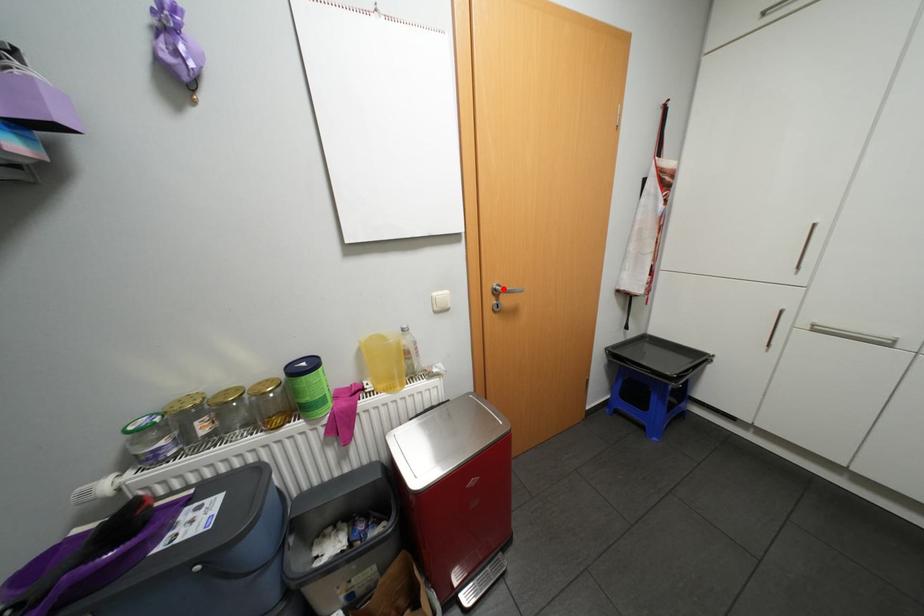
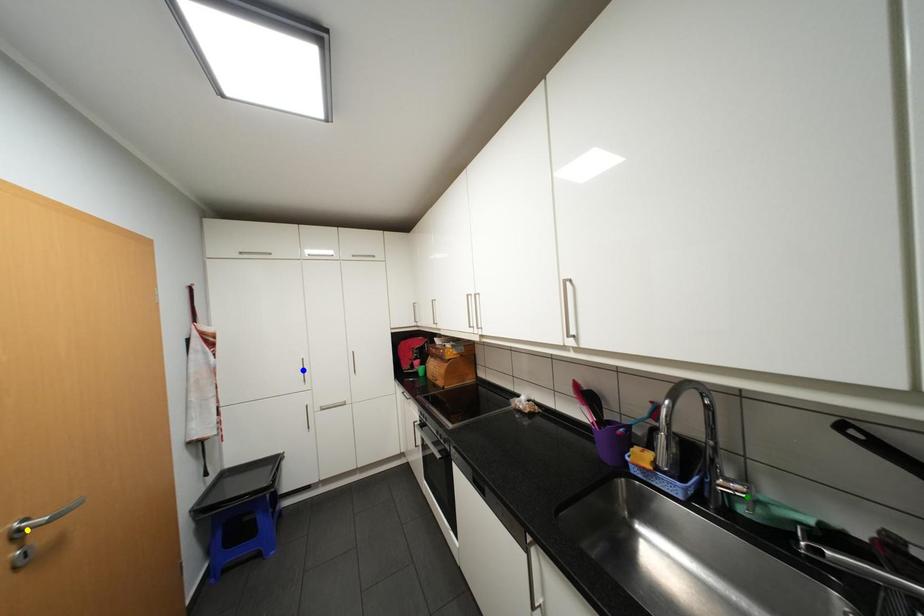
Question: I am providing you with two images of the same scene from different viewpoints. A red point is marked on the first image. You are given multiple points on the second image. Can you choose the point in image 2 that corresponds to the point in image 1?

Choices:
 (A) green point
 (B) yellow point
 (C) blue point

Answer: (B)